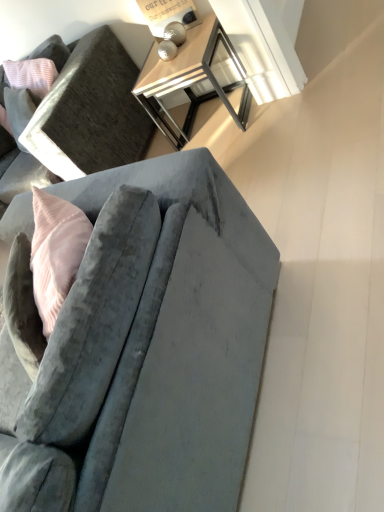
Question: Is point (107, 290) positioned closer to the camera than point (165, 33)?

Choices:
 (A) farther
 (B) closer

Answer: (B)

Question: Considering their positions, is velvet gray couch at center, the second studio couch viewed from the top, located in front of or behind metallic silver table lamp at upper center?

Choices:
 (A) front
 (B) behind

Answer: (A)

Question: Estimate the real-world distances between objects in this image. Which object is closer to the metallic silver table at upper center?

Choices:
 (A) velvet gray couch at lower left, the 2th studio couch in the bottom-to-top sequence
 (B) velvet gray couch at center, the 1th studio couch in the bottom-to-top sequence
 (C) metallic silver table lamp at upper center

Answer: (C)

Question: Considering the real-world distances, which object is closest to the metallic silver table lamp at upper center?

Choices:
 (A) metallic silver table at upper center
 (B) velvet gray couch at center, the 1th studio couch in the bottom-to-top sequence
 (C) velvet gray couch at lower left, the 2th studio couch in the bottom-to-top sequence

Answer: (A)